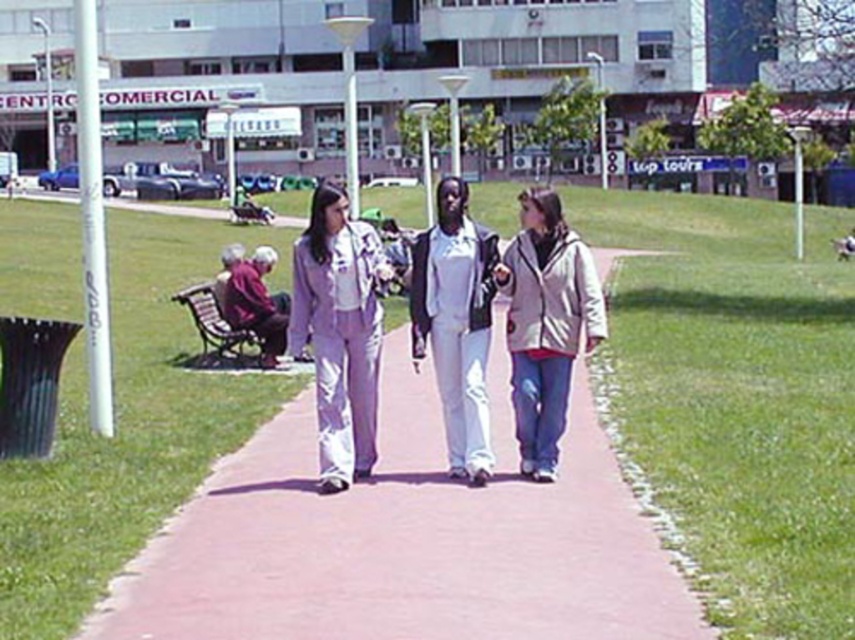
Question: Which object is farther from the camera taking this photo?

Choices:
 (A) matte white suit at center
 (B) green grass at center

Answer: (A)

Question: Is matte white suit at center wider than white matte pants at center?

Choices:
 (A) no
 (B) yes

Answer: (B)

Question: Is green grass at center below white matte pants at center?

Choices:
 (A) no
 (B) yes

Answer: (A)

Question: Which of the following is the closest to the observer?

Choices:
 (A) matte white suit at center
 (B) beige fleece jacket at center

Answer: (A)

Question: Among these points, which one is farthest from the camera?

Choices:
 (A) (140, 502)
 (B) (514, 337)
 (C) (437, 339)

Answer: (B)

Question: Is beige fleece jacket at center below maroon fabric jacket at left?

Choices:
 (A) yes
 (B) no

Answer: (A)